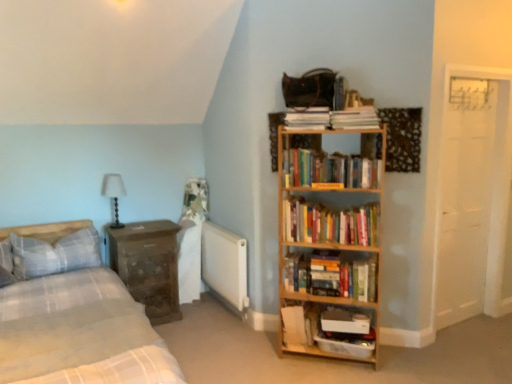
Identify the location of vacant space that is to the left of hardcover book at center, marked as the first paperback book in a bottom-to-top arrangement. (269, 350).